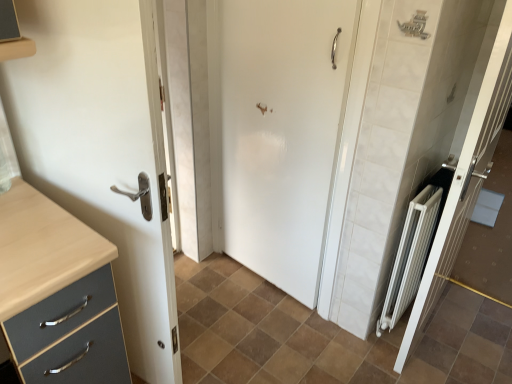
You are a GUI agent. You are given a task and a screenshot of the screen. Output one action in this format:
    pyautogui.click(x=<x>, y=<y>)
    Task: Click on the free point in front of white matte door at center, arranged as the second door when viewed from the right
    
    Given the screenshot: What is the action you would take?
    pyautogui.click(x=260, y=332)